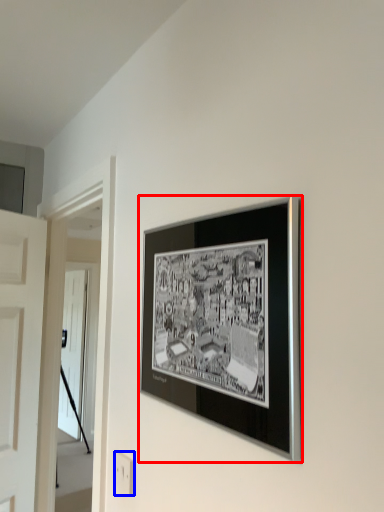
Question: Which object appears farthest to the camera in this image, picture frame (highlighted by a red box) or electric outlet (highlighted by a blue box)?

Choices:
 (A) picture frame
 (B) electric outlet

Answer: (B)